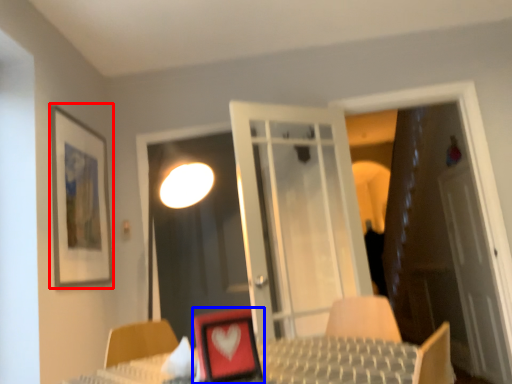
Question: Among these objects, which one is farthest to the camera, picture frame (highlighted by a red box) or picture frame (highlighted by a blue box)?

Choices:
 (A) picture frame
 (B) picture frame

Answer: (A)